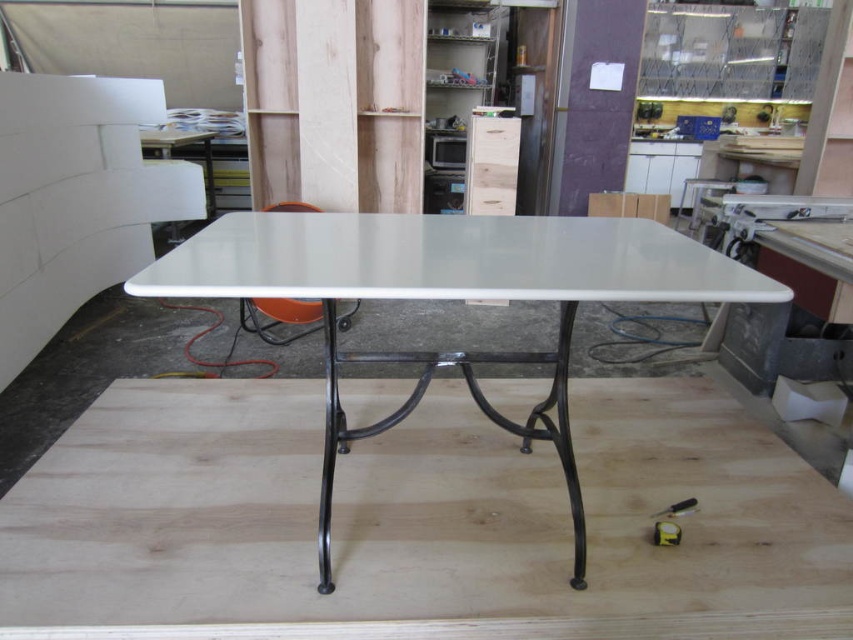
Which is above, natural wood plywood at center or white glossy table at center?

white glossy table at center

Does point (140, 518) lie behind point (331, 486)?

Yes, it is.

Locate an element on the screen. The width and height of the screenshot is (853, 640). natural wood plywood at center is located at coordinates (416, 522).